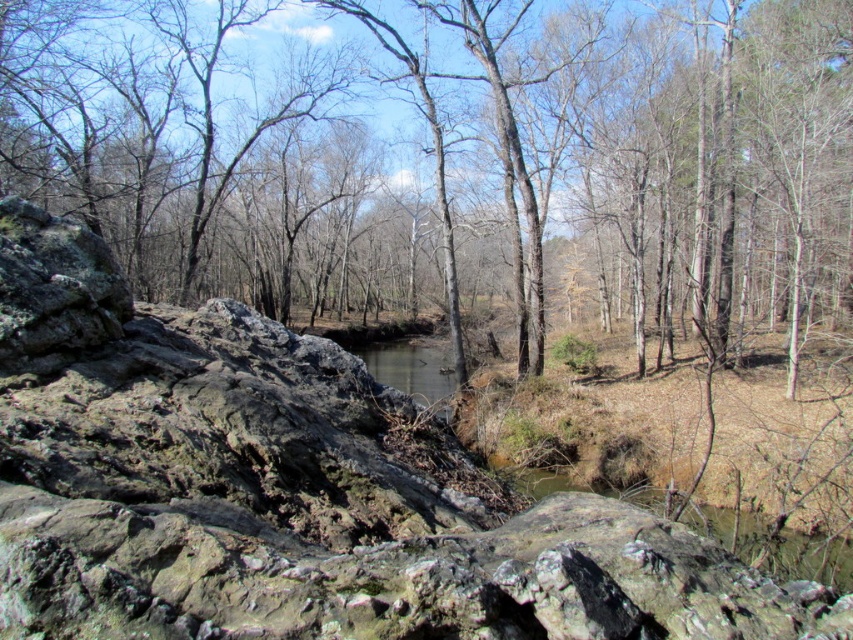
You are standing in the rocky landscape and want to pick up the closest rock to you. Which rock should you choose between the brown rough rock at left and the rough textured rock at center?

The brown rough rock at left is closer to you, so you should choose it.